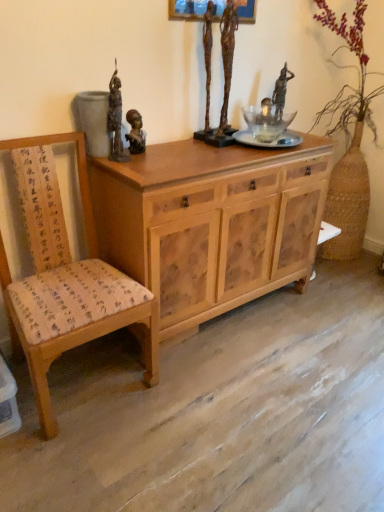
Identify the location of vacant space to the right of bronze statue at center, marked as the first person in a front-to-back arrangement. (181, 151).